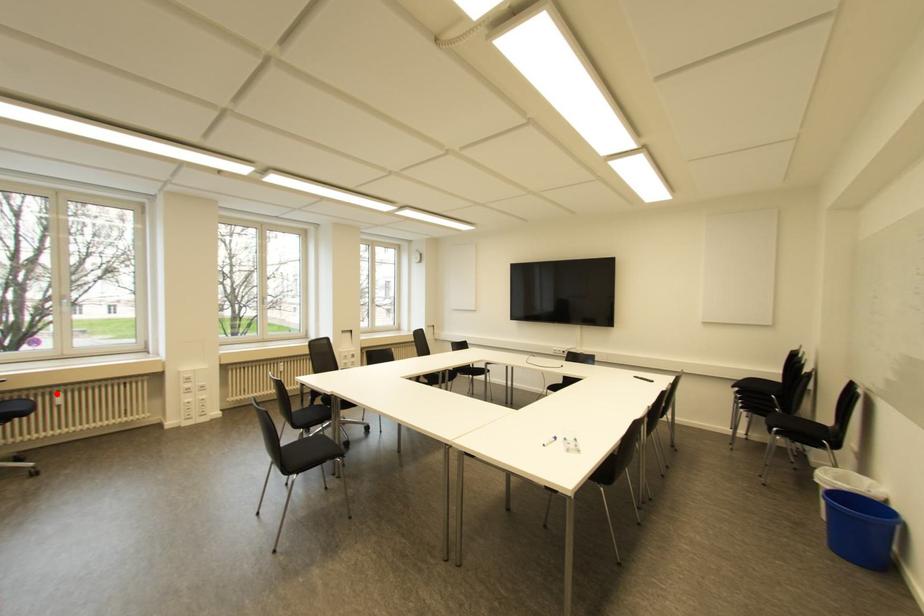
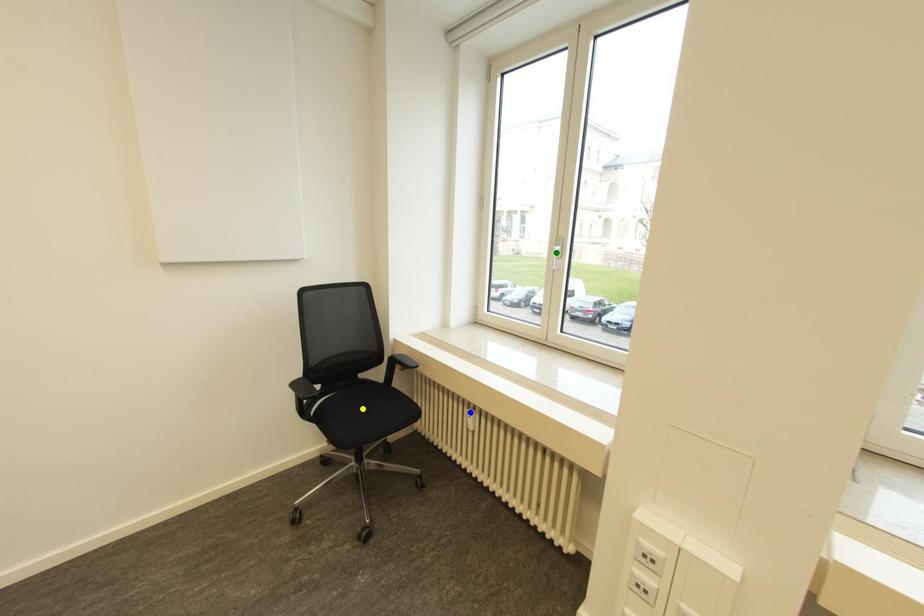
Question: I am providing you with two images of the same scene from different viewpoints. A red point is marked on the first image. You are given multiple points on the second image. In image 2, which mark is for the same physical point as the one in image 1?

Choices:
 (A) green point
 (B) blue point
 (C) yellow point

Answer: (B)